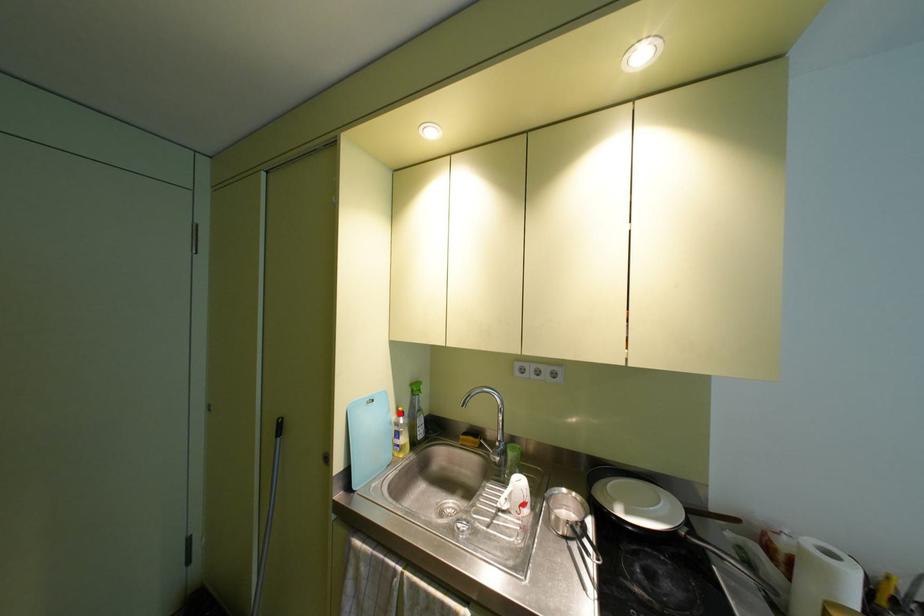
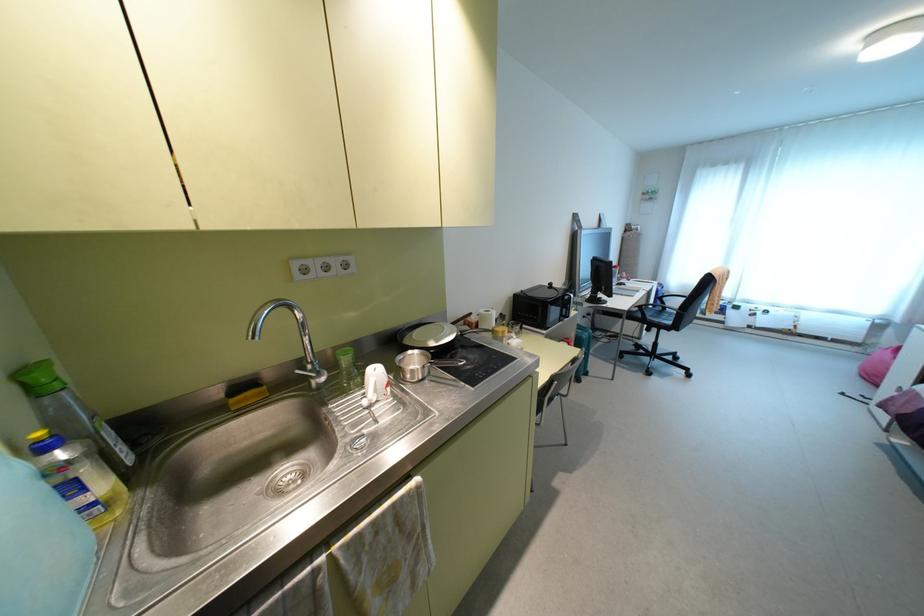
Where in the second image is the point corresponding to the highlighted location from the first image?

(43, 447)